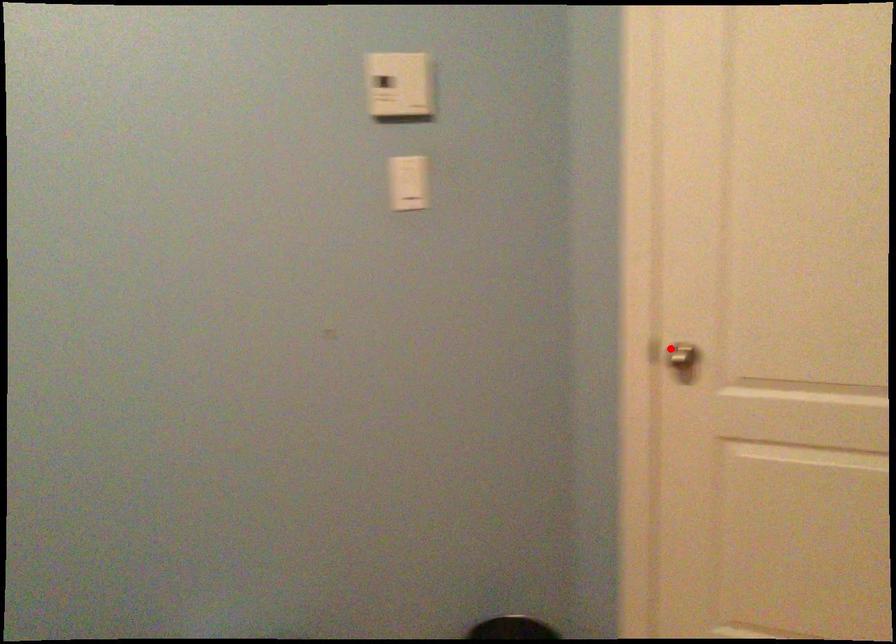
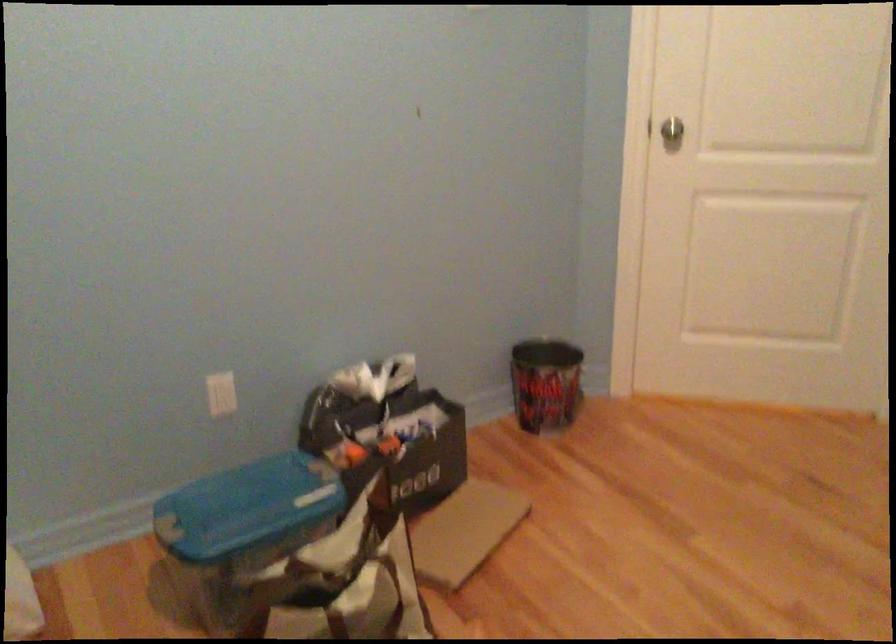
Find the pixel in the second image that matches the highlighted location in the first image.

(667, 128)